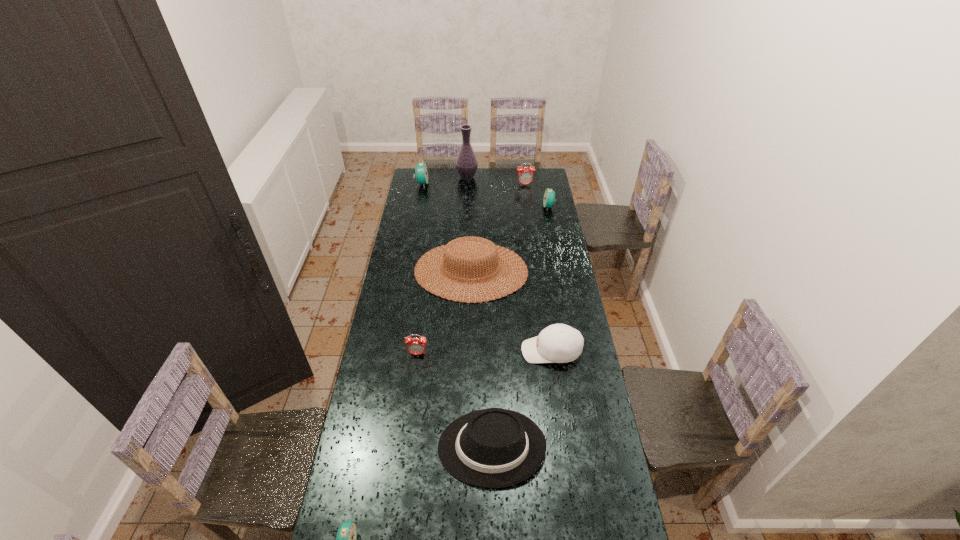
Where is `free space that satisfies the following two spatial constraints: 1. on the front-facing side of the biggest blue alarm clock; 2. on the back side of the fifth nearest object`? free space that satisfies the following two spatial constraints: 1. on the front-facing side of the biggest blue alarm clock; 2. on the back side of the fifth nearest object is located at coordinates pyautogui.click(x=406, y=271).